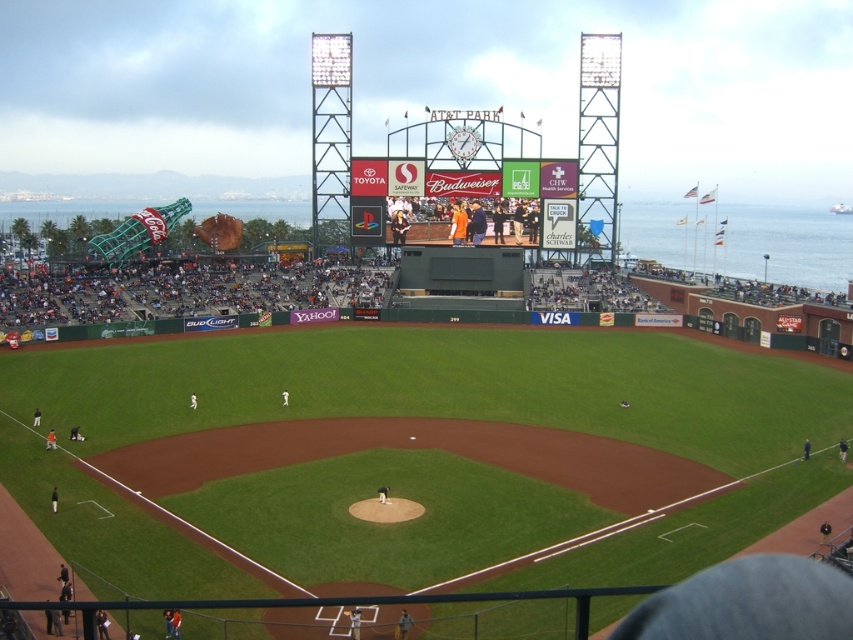
You are a spectator sitting in the stands at AT T Park and you see the matte digital screen at center and the orange jersey at center. Which object is located to the right of the other?

The matte digital screen at center is positioned on the right side of orange jersey at center.

Based on the scene at AT T Park, where exactly is the green grass at center located?

The green grass at center is located at point (x=428, y=416).